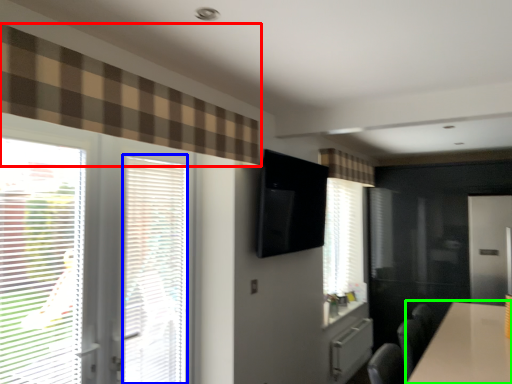
Question: Considering the real-world distances, which object is farthest from curtain (highlighted by a red box)? blind (highlighted by a blue box) or table (highlighted by a green box)?

Choices:
 (A) blind
 (B) table

Answer: (B)